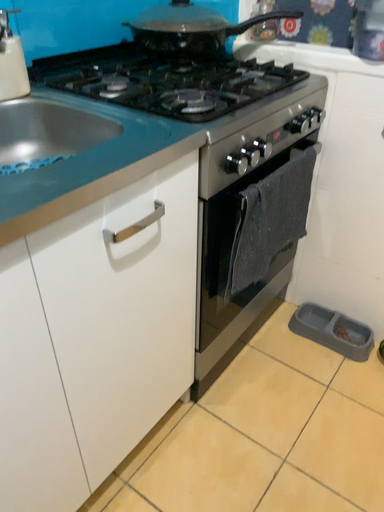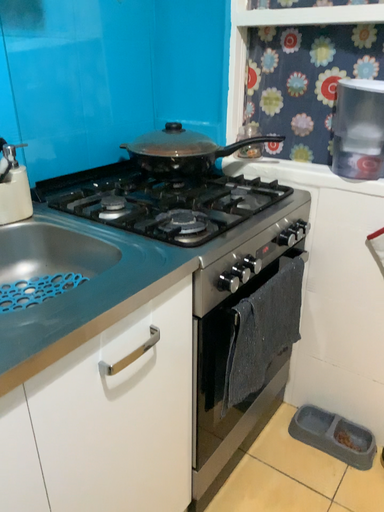
Question: How did the camera likely rotate when shooting the video?

Choices:
 (A) rotated upward
 (B) rotated downward

Answer: (A)